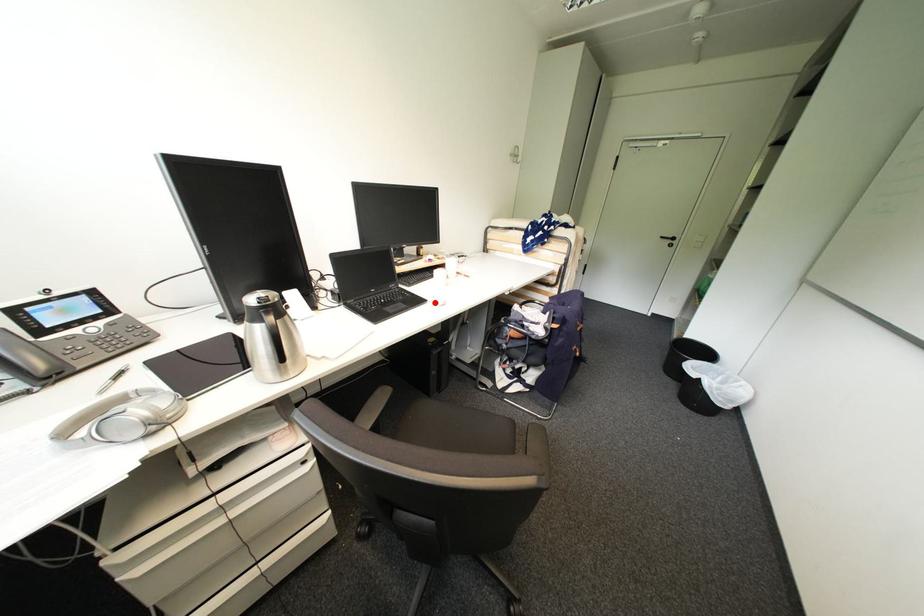
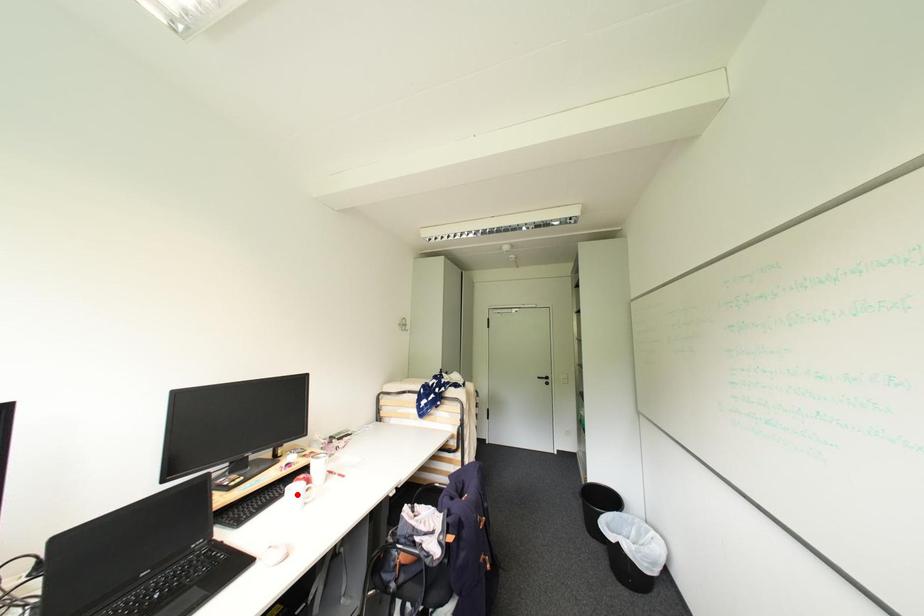
Based on the photo, I am providing you with two images of the same scene from different viewpoints. A red point is marked on the first image and another point is marked on the second image. Is the marked point in image1 the same physical position as the marked point in image2?

No